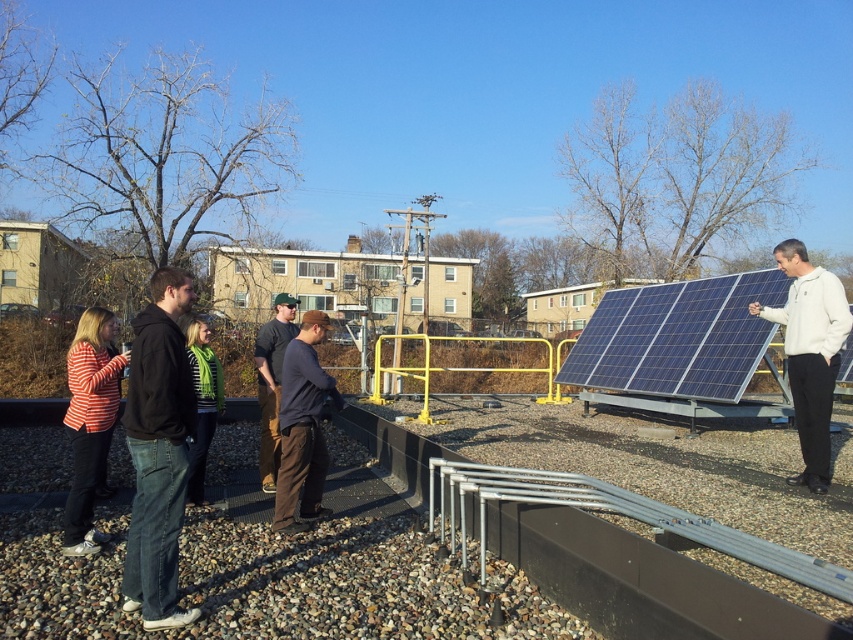
You are a photographer trying to capture a group photo of the people around the solar panels. You want to ensure that both the dark blue cotton shirt at center and the green knitted scarf at center are clearly visible in the photo. Which object should you focus on first to ensure it doesn t get cut off?

The dark blue cotton shirt at center is much taller than the green knitted scarf at center, so you should focus on ensuring the dark blue cotton shirt at center is fully visible first to prevent it from being cut off.

You are standing at the point with coordinates point [200,438] and want to move to the point with coordinates point [335,400]. Which direction should you move to reach your destination?

You should move forward to reach point [335,400] because it is in front of point [200,438].